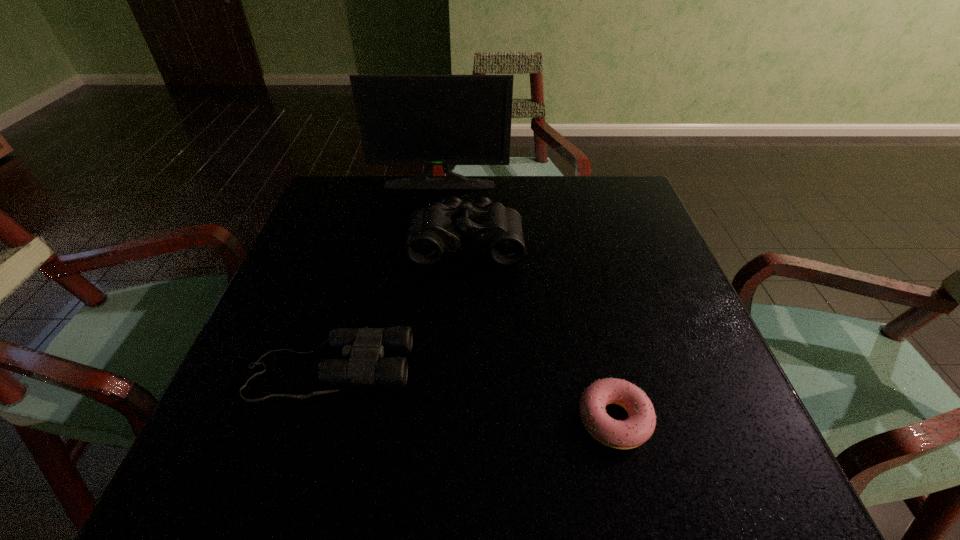
You are a GUI agent. You are given a task and a screenshot of the screen. Output one action in this format:
    pyautogui.click(x=<x>, y=<y>)
    Task: Click on the free space at the far edge of the desktop
    The image size is (960, 540).
    Given the screenshot: What is the action you would take?
    pyautogui.click(x=491, y=188)

Locate an element on the screen. The width and height of the screenshot is (960, 540). vacant position at the near edge of the desktop is located at coordinates (581, 479).

Find the location of a particular element. The width and height of the screenshot is (960, 540). vacant region at the left edge is located at coordinates (314, 230).

This screenshot has width=960, height=540. Identify the location of free region at the right edge. (665, 272).

Locate an element on the screen. The height and width of the screenshot is (540, 960). free spot at the far left corner of the desktop is located at coordinates (327, 204).

Where is `vacant region at the near left corner of the desktop`? The height and width of the screenshot is (540, 960). vacant region at the near left corner of the desktop is located at coordinates click(x=255, y=472).

Find the location of a particular element. The height and width of the screenshot is (540, 960). vacant space at the far right corner of the desktop is located at coordinates (586, 190).

I want to click on empty space that is in between the shorter binoculars and the taller binoculars, so click(398, 306).

What are the coordinates of `vacant space that is in between the shortest object and the taller binoculars` in the screenshot? It's located at (540, 331).

The image size is (960, 540). In order to click on vacant area between the rightmost object and the shorter binoculars in this screenshot , I will do point(472,394).